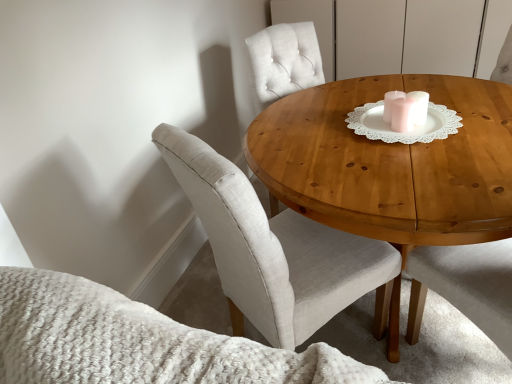
Question: From the image's perspective, is white lace doily at center beneath wooden table at center?

Choices:
 (A) no
 (B) yes

Answer: (A)

Question: From a real-world perspective, is white lace doily at center beneath wooden table at center?

Choices:
 (A) yes
 (B) no

Answer: (B)

Question: Is white lace doily at center at the right side of wooden table at center?

Choices:
 (A) yes
 (B) no

Answer: (B)

Question: Can you confirm if white lace doily at center is thinner than wooden table at center?

Choices:
 (A) no
 (B) yes

Answer: (B)

Question: Can you confirm if white lace doily at center is taller than wooden table at center?

Choices:
 (A) yes
 (B) no

Answer: (B)

Question: Would you say white lace doily at center is inside or outside wooden table at center?

Choices:
 (A) outside
 (B) inside

Answer: (A)

Question: In terms of height, does white lace doily at center look taller or shorter compared to wooden table at center?

Choices:
 (A) tall
 (B) short

Answer: (B)

Question: In the image, is white lace doily at center positioned in front of or behind wooden table at center?

Choices:
 (A) front
 (B) behind

Answer: (B)

Question: From a real-world perspective, is white lace doily at center above or below wooden table at center?

Choices:
 (A) below
 (B) above

Answer: (B)

Question: In terms of height, does wooden table at center look taller or shorter compared to light beige fabric chair at center?

Choices:
 (A) tall
 (B) short

Answer: (B)

Question: Is wooden table at center to the left or to the right of light beige fabric chair at center in the image?

Choices:
 (A) right
 (B) left

Answer: (A)

Question: Considering the positions of wooden table at center and light beige fabric chair at center in the image, is wooden table at center wider or thinner than light beige fabric chair at center?

Choices:
 (A) thin
 (B) wide

Answer: (B)

Question: Considering the positions of wooden table at center and light beige fabric chair at center in the image, is wooden table at center bigger or smaller than light beige fabric chair at center?

Choices:
 (A) small
 (B) big

Answer: (B)

Question: Relative to light beige fabric chair at center, is white lace doily at center in front or behind?

Choices:
 (A) behind
 (B) front

Answer: (A)

Question: Considering the positions of point (423, 109) and point (296, 286), is point (423, 109) closer or farther from the camera than point (296, 286)?

Choices:
 (A) farther
 (B) closer

Answer: (A)